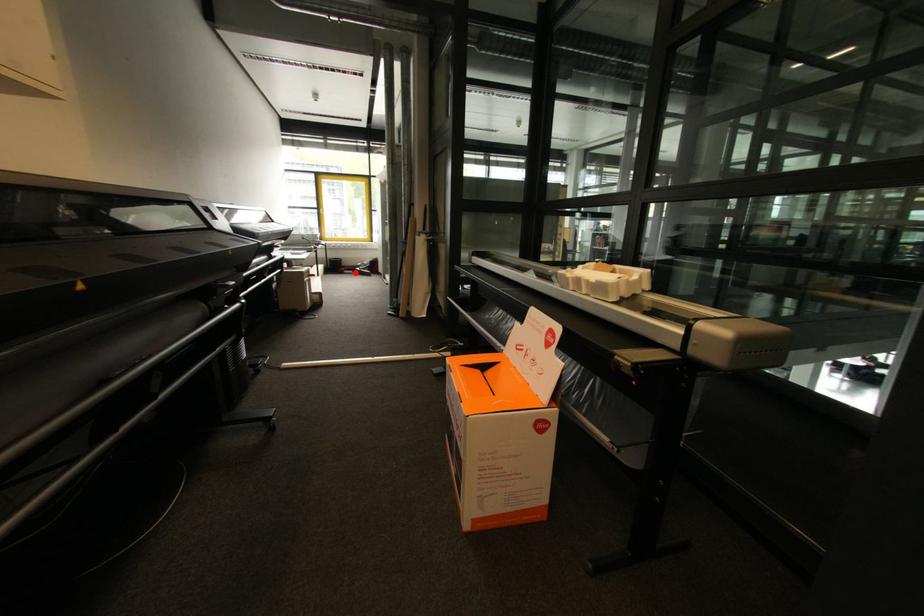
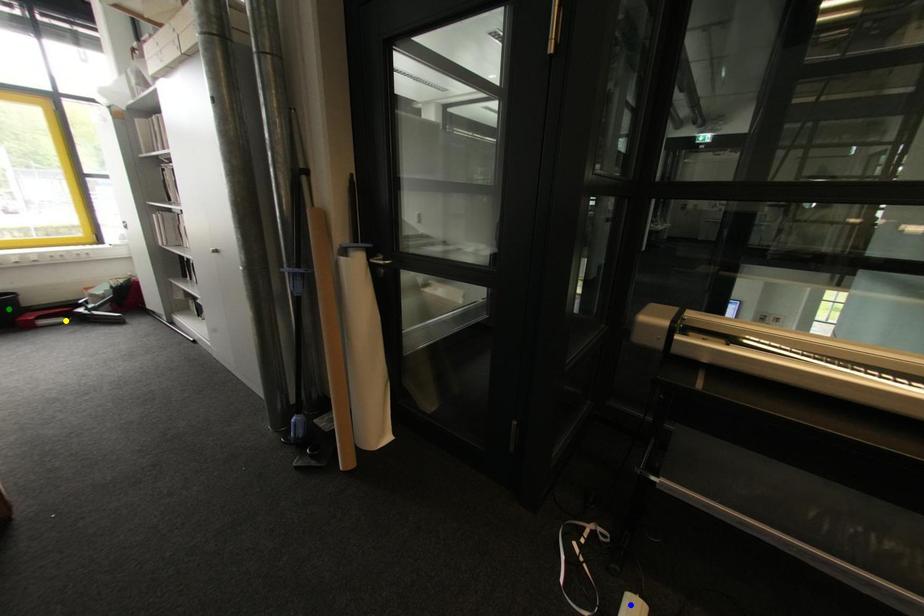
Question: I am providing you with two images of the same scene from different viewpoints. A red point is marked on the first image. You are given multiple points on the second image. Can you choose the point in image 2 that corresponds to the point in image 1?

Choices:
 (A) green point
 (B) yellow point
 (C) blue point

Answer: (B)